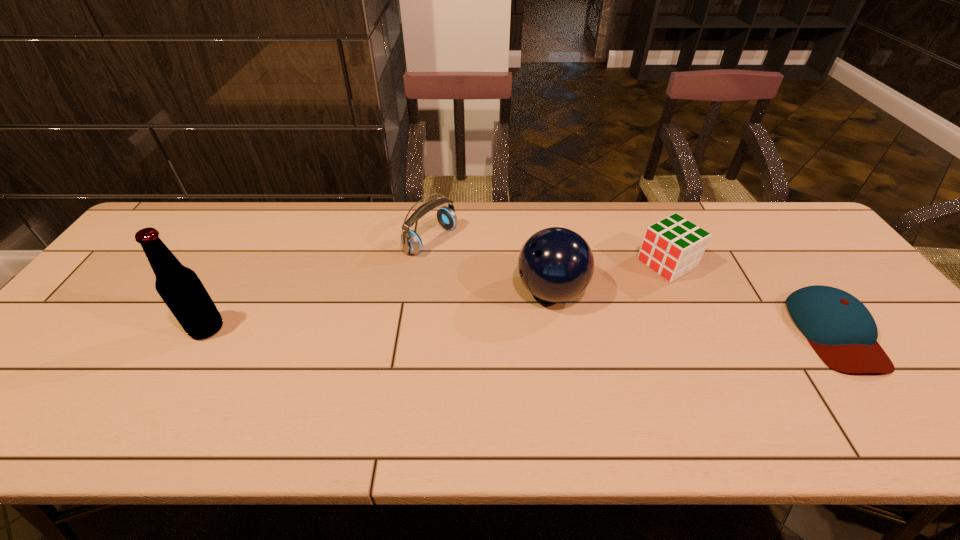
Identify the location of cube present at the far edge. (673, 246).

This screenshot has width=960, height=540. What are the coordinates of `headset positioned at the far edge` in the screenshot? It's located at (412, 244).

Where is `object located at the near edge`? object located at the near edge is located at coordinates (841, 330).

What are the coordinates of `object that is positioned at the right edge` in the screenshot? It's located at (841, 330).

This screenshot has width=960, height=540. In order to click on object located at the near right corner in this screenshot , I will do `click(841, 330)`.

Image resolution: width=960 pixels, height=540 pixels. Find the location of `vacant region at the far edge`. vacant region at the far edge is located at coordinates 532,210.

Where is `vacant region at the left edge of the desktop`? The image size is (960, 540). vacant region at the left edge of the desktop is located at coordinates (53, 356).

Image resolution: width=960 pixels, height=540 pixels. In the image, there is a desktop. What are the coordinates of `vacant space at the far left corner` in the screenshot? It's located at (177, 245).

You are a GUI agent. You are given a task and a screenshot of the screen. Output one action in this format:
    pyautogui.click(x=<x>, y=<y>)
    Task: Click on the free spot between the rightmost object and the third object from left to right
    Image resolution: width=960 pixels, height=540 pixels.
    Given the screenshot: What is the action you would take?
    [693, 312]

Identify the location of empty space that is in between the fourth tallest object and the tallest object. This screenshot has height=540, width=960. (437, 296).